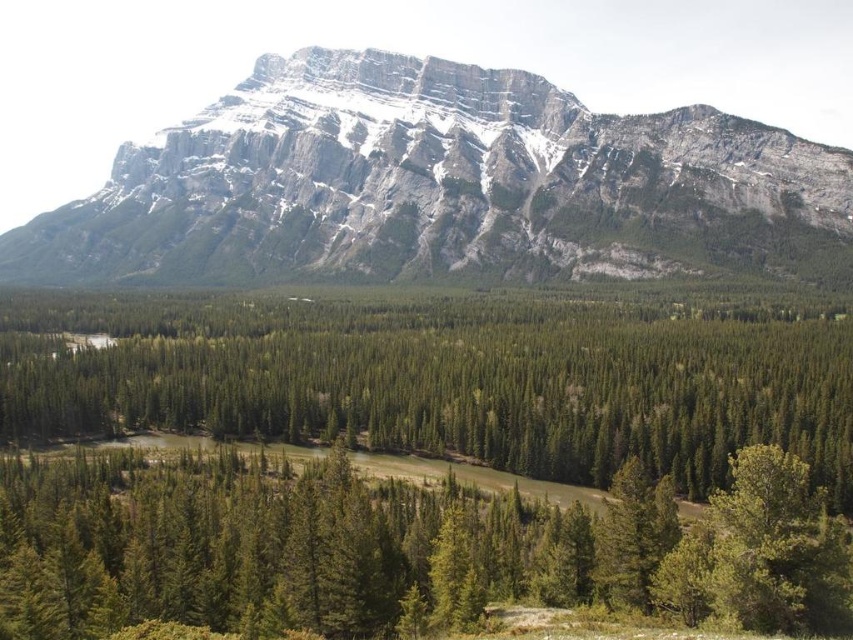
Does green textured forest at center have a lesser width compared to green matte tree at lower right?

In fact, green textured forest at center might be wider than green matte tree at lower right.

Can you confirm if green textured forest at center is bigger than green matte tree at lower right?

Yes.

Who is more distant from viewer, (265, 317) or (608, 515)?

The point (265, 317) is more distant.

Identify the location of green textured forest at center. The width and height of the screenshot is (853, 640). (444, 380).

Is green textured forest at center behind green matte tree at lower center?

Yes, it is.

Does green textured forest at center have a larger size compared to green matte tree at lower center?

Yes.

This screenshot has width=853, height=640. In order to click on green textured forest at center in this screenshot , I will do `click(444, 380)`.

Where is `green textured forest at center`? This screenshot has width=853, height=640. green textured forest at center is located at coordinates (444, 380).

Is rocky gray mountain range at upper center positioned in front of green textured forest at center?

No, it is not.

This screenshot has width=853, height=640. Identify the location of rocky gray mountain range at upper center. (444, 186).

Find the location of `rocky gray mountain range at upper center`. rocky gray mountain range at upper center is located at coordinates (444, 186).